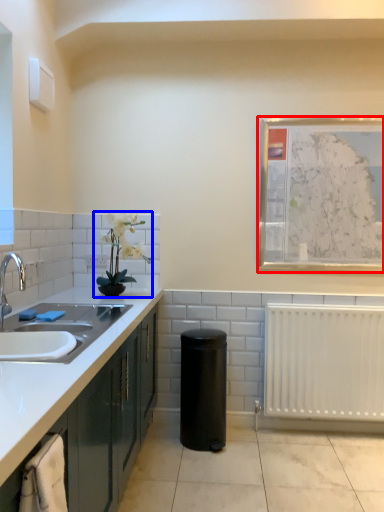
Question: Which of the following is the closest to the observer, picture frame (highlighted by a red box) or houseplant (highlighted by a blue box)?

Choices:
 (A) picture frame
 (B) houseplant

Answer: (B)